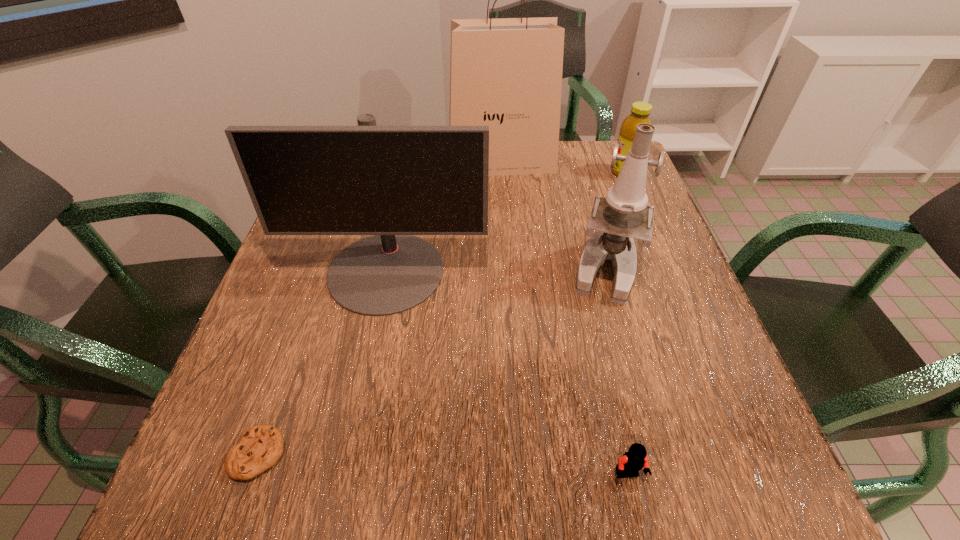
This screenshot has width=960, height=540. I want to click on free space that satisfies the following two spatial constraints: 1. on the back side of the shopping bag; 2. on the right side of the cookie, so click(x=360, y=163).